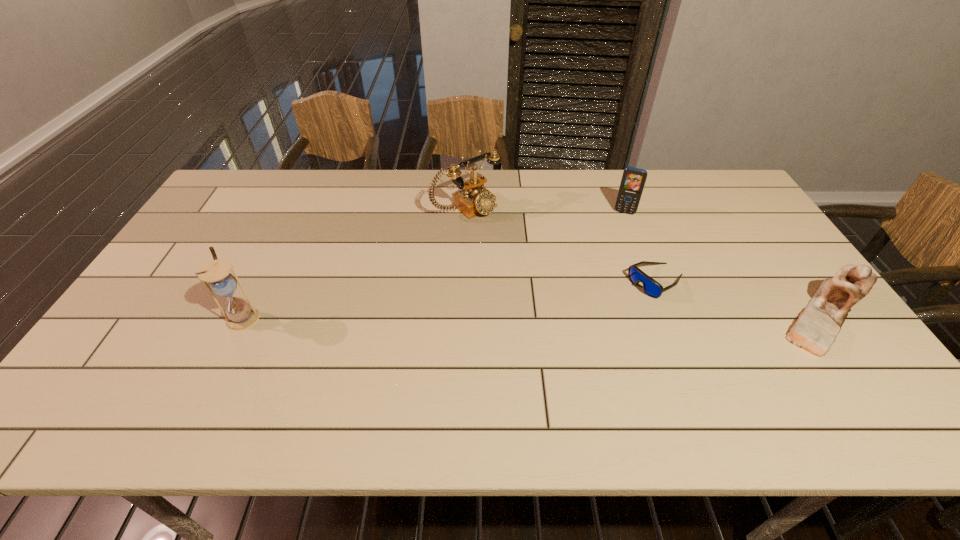
Where is `vacant region that satisfies the following two spatial constraints: 1. on the front side of the telephone; 2. on the left side of the cellular telephone`? This screenshot has height=540, width=960. vacant region that satisfies the following two spatial constraints: 1. on the front side of the telephone; 2. on the left side of the cellular telephone is located at coordinates pos(467,212).

Find the location of a particular element. This screenshot has width=960, height=540. vacant space that satisfies the following two spatial constraints: 1. on the back side of the leftmost object; 2. on the front-facing side of the figurine is located at coordinates (244, 316).

Locate an element on the screen. The width and height of the screenshot is (960, 540). vacant area in the image that satisfies the following two spatial constraints: 1. on the front side of the rightmost object; 2. on the front-facing side of the cellular telephone is located at coordinates (664, 316).